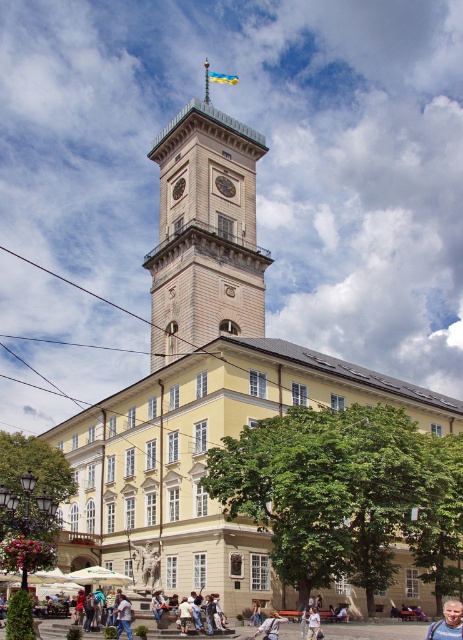
Looking at this image, you are standing in front of the historic building and want to take a photo of the light brown stone clock tower at center and the blue jeans at lower center. Which object should you focus on first to ensure both are in the frame?

You should focus on the light brown stone clock tower at center first because it is closer to you than the blue jeans at lower center, so adjusting the camera to include both would require ensuring the tower is framed first before the jeans.

You are an architect visiting this historic building and want to compare the sizes of the two central features. Which one is larger between the light brown stone clock tower at center and the golden polished clock at center?

The light brown stone clock tower at center is bigger than the golden polished clock at center, so the clock tower is larger.